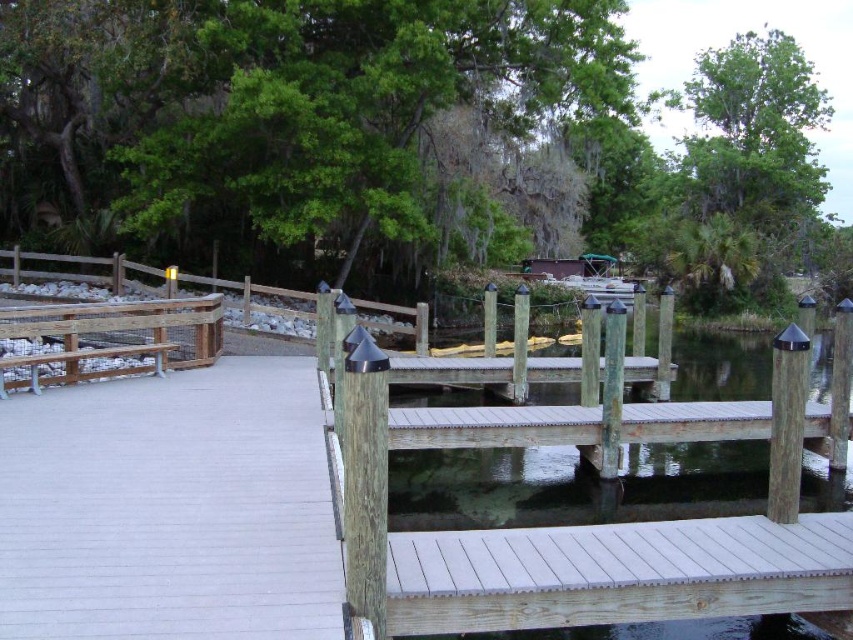
You are a visitor standing on the wooden bench at left and want to step onto the white wood dock at center. Is the dock directly below you?

The white wood dock at center is positioned under the wooden bench at left, so yes, the dock is directly below you.

You are standing on the wooden dock and want to move towards the trees in the background. You see two points marked on the dock, point 1 at coordinates point (442, 554) and point 2 at coordinates point (218, 339). Which point should you walk towards to get closer to the trees?

Point (218, 339) is further away from the viewer than point (442, 554). Therefore, walking towards point (218, 339) will get you closer to the trees in the background.

Consider the image. You are standing at the point marked as point (616, 573) in the image. Looking around, you see the white wood dock at center. Which direction should you walk to reach the wooden walkway with railings leading towards the trees?

The white wood dock at center is located at point (616, 573). Since the wooden walkway with railings runs parallel to the dock and leads towards the trees, you should walk along the dock towards the direction where the walkway is positioned. However, without specific directional coordinates, the exact direction cannot be determined, but following the dock towards the trees would align with the walkway.